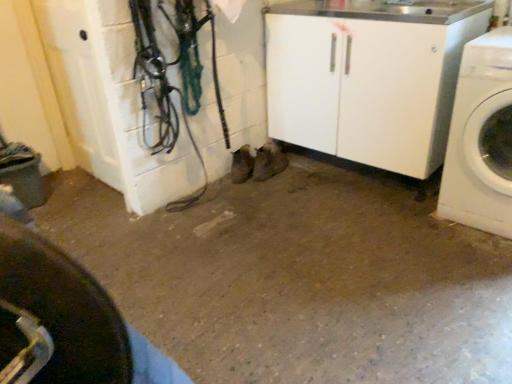
Question: From a real-world perspective, is black rubber tire at lower left under white glossy washing machine at right?

Choices:
 (A) no
 (B) yes

Answer: (A)

Question: Is black rubber tire at lower left facing away from white glossy washing machine at right?

Choices:
 (A) no
 (B) yes

Answer: (A)

Question: Is black rubber tire at lower left directly adjacent to white glossy washing machine at right?

Choices:
 (A) yes
 (B) no

Answer: (B)

Question: Is black rubber tire at lower left at the right side of white glossy washing machine at right?

Choices:
 (A) no
 (B) yes

Answer: (A)

Question: Is black rubber tire at lower left closer to camera compared to white glossy washing machine at right?

Choices:
 (A) no
 (B) yes

Answer: (B)

Question: Does black rubber tire at lower left have a lesser height compared to white glossy washing machine at right?

Choices:
 (A) yes
 (B) no

Answer: (A)

Question: Does white glossy washing machine at right have a smaller size compared to black rubber tire at lower left?

Choices:
 (A) no
 (B) yes

Answer: (A)

Question: From a real-world perspective, is white glossy washing machine at right physically above black rubber tire at lower left?

Choices:
 (A) yes
 (B) no

Answer: (B)

Question: Is white glossy washing machine at right behind black rubber tire at lower left?

Choices:
 (A) yes
 (B) no

Answer: (A)

Question: Is white glossy washing machine at right to the right of black rubber tire at lower left from the viewer's perspective?

Choices:
 (A) no
 (B) yes

Answer: (B)

Question: Would you say white glossy washing machine at right is outside black rubber tire at lower left?

Choices:
 (A) no
 (B) yes

Answer: (B)

Question: Does white glossy washing machine at right have a greater width compared to black rubber tire at lower left?

Choices:
 (A) yes
 (B) no

Answer: (A)

Question: Relative to white glossy washing machine at right, is black rubber tire at lower left in front or behind?

Choices:
 (A) front
 (B) behind

Answer: (A)